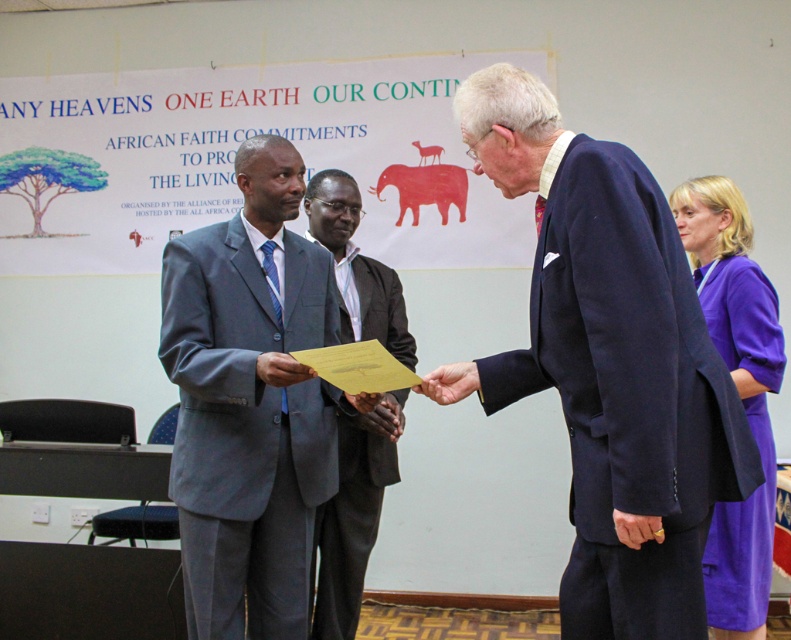
The height and width of the screenshot is (640, 791). What are the coordinates of `purple fabric dress at right` in the screenshot? It's located at (737, 392).

Between purple fabric dress at right and light blue fabric suit at center, which one has more height?

light blue fabric suit at center

Between point (697, 269) and point (332, 180), which one is positioned in front?

Point (697, 269)

Identify the location of purple fabric dress at right. (737, 392).

Who is more forward, (691,488) or (763,419)?

Point (691,488) is more forward.

Who is shorter, navy blue suit at center or purple fabric dress at right?

navy blue suit at center

Is point (679, 593) more distant than point (766, 316)?

No, (679, 593) is closer to viewer.

At what (x,y) coordinates should I click in order to perform the action: click on navy blue suit at center. Please return your answer as a coordinate pair (x, y). The height and width of the screenshot is (640, 791). Looking at the image, I should click on (608, 365).

Which is more to the right, navy blue suit at center or matte gray suit at center?

navy blue suit at center

Is point (687, 289) positioned behind point (305, 316)?

No, (687, 289) is in front of (305, 316).

The width and height of the screenshot is (791, 640). Identify the location of navy blue suit at center. (608, 365).